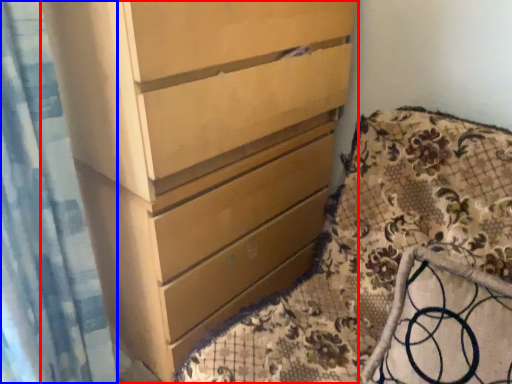
Question: Which object is further to the camera taking this photo, chest of drawers (highlighted by a red box) or shower curtain (highlighted by a blue box)?

Choices:
 (A) chest of drawers
 (B) shower curtain

Answer: (A)